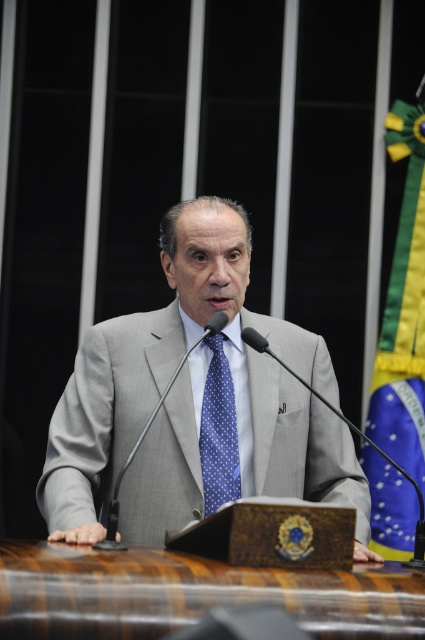
Can you confirm if gray fabric suit at center is positioned above blue fabric flag at right?

Incorrect, gray fabric suit at center is not positioned above blue fabric flag at right.

Can you confirm if gray fabric suit at center is positioned below blue fabric flag at right?

Indeed, gray fabric suit at center is positioned under blue fabric flag at right.

You are a GUI agent. You are given a task and a screenshot of the screen. Output one action in this format:
    pyautogui.click(x=<x>, y=<y>)
    Task: Click on the gray fabric suit at center
    
    Given the screenshot: What is the action you would take?
    pyautogui.click(x=195, y=403)

Who is positioned more to the left, blue fabric flag at right or blue dotted fabric tie at center?

Positioned to the left is blue dotted fabric tie at center.

Based on the photo, is blue fabric flag at right thinner than blue dotted fabric tie at center?

No.

The height and width of the screenshot is (640, 425). Describe the element at coordinates (404, 308) in the screenshot. I see `blue fabric flag at right` at that location.

Find the location of a particular element. blue fabric flag at right is located at coordinates (404, 308).

Which is more to the right, gray fabric suit at center or blue dotted fabric tie at center?

From the viewer's perspective, blue dotted fabric tie at center appears more on the right side.

Is point (223, 497) less distant than point (201, 472)?

Yes.

Between point (161, 456) and point (227, 456), which one is positioned in front?

Point (161, 456)

This screenshot has width=425, height=640. I want to click on gray fabric suit at center, so click(195, 403).